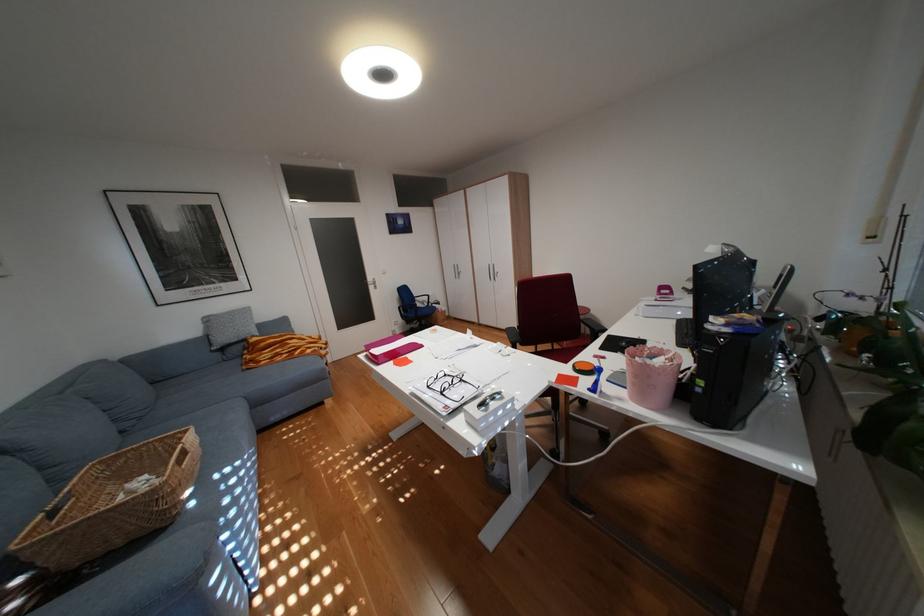
Find where to sit the sofa sitting surface. Please return your answer as a coordinate pair (x, y).

(201, 392)